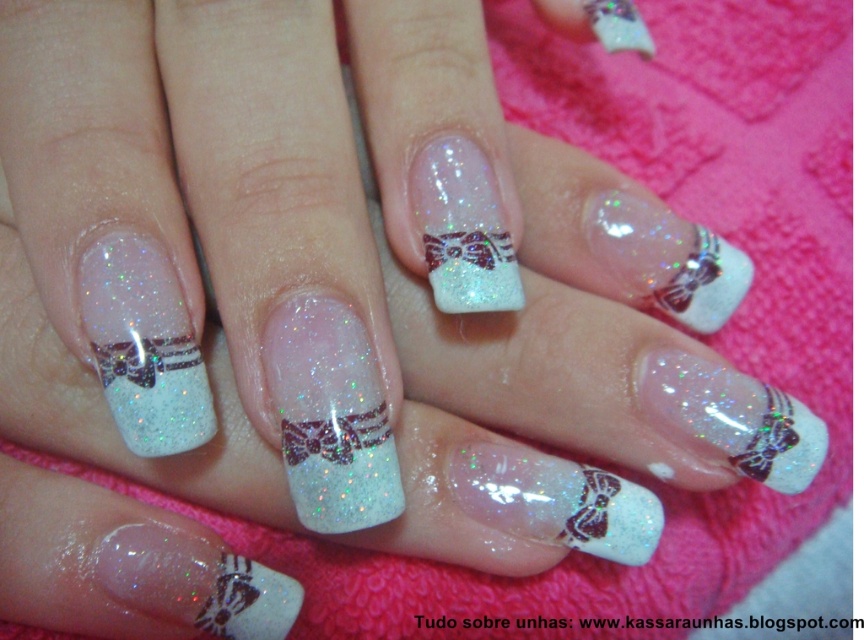
Which is below, glittery white nail at center or glittery metallic bow at center?

glittery metallic bow at center is lower down.

Is glittery white nail at center taller than glittery metallic bow at center?

Yes.

Is point (110, 310) farther from viewer compared to point (289, 444)?

Yes, it is.

Identify the location of glittery white nail at center. The width and height of the screenshot is (864, 640). (144, 346).